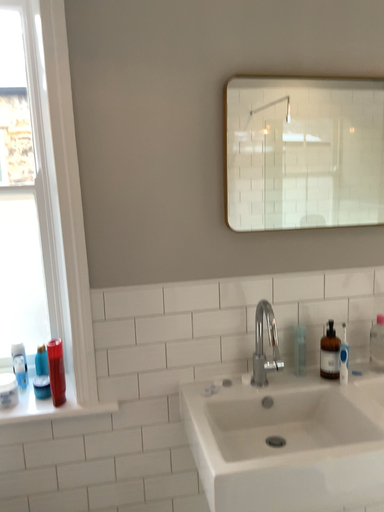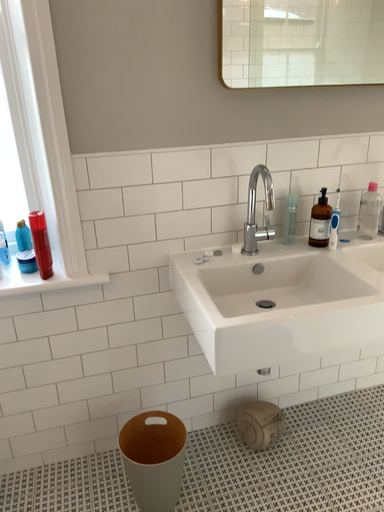
Question: Which way did the camera rotate in the video?

Choices:
 (A) rotated downward
 (B) rotated upward

Answer: (A)